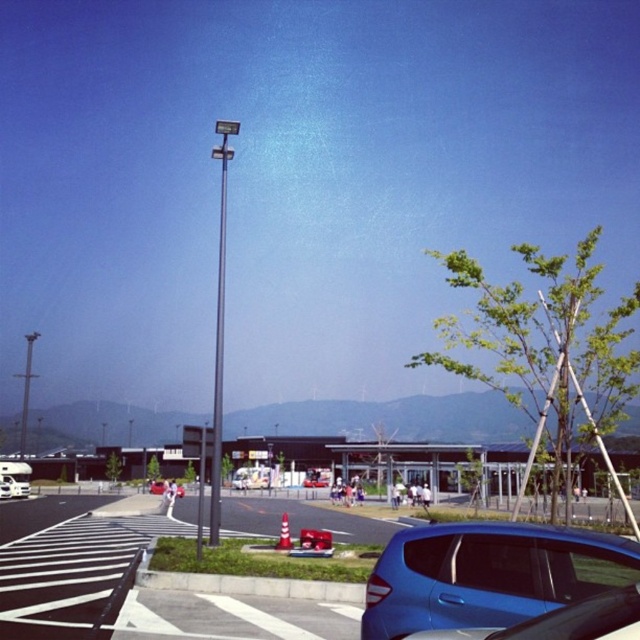
You are a delivery driver who needs to park your vehicle in a spot that can accommodate the height of your vehicle. You see a metallic silver car at center and a metallic silver van at center. Which vehicle is shorter and would fit in a lower height parking space?

The metallic silver car at center is not as tall as the metallic silver van at center, so the metallic silver car at center would fit in a lower height parking space.